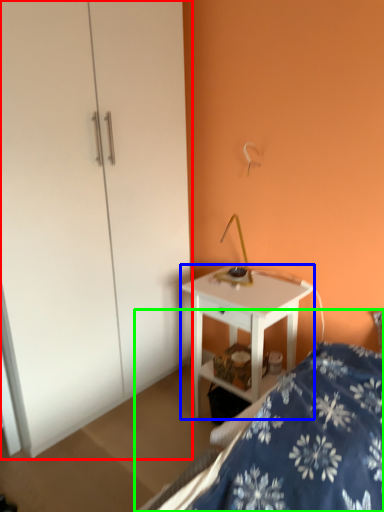
Question: Considering the real-world distances, which object is closest to dresser (highlighted by a red box)? desk (highlighted by a blue box) or bed (highlighted by a green box).

Choices:
 (A) desk
 (B) bed

Answer: (A)